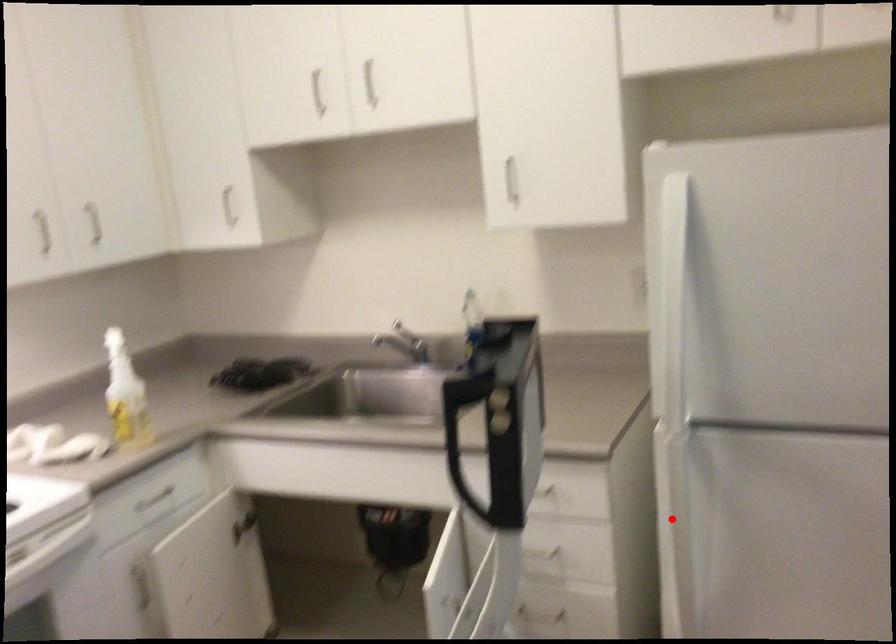
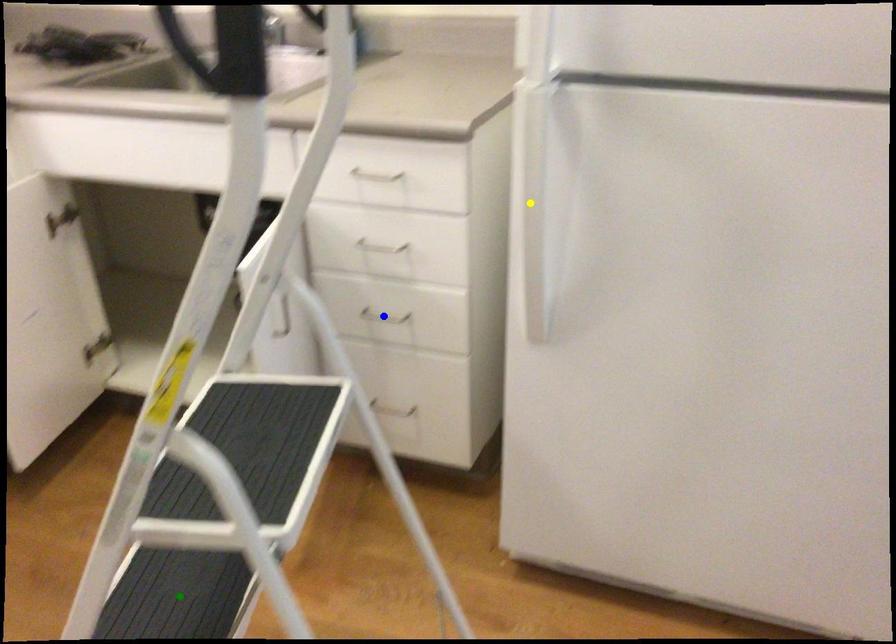
Question: I am providing you with two images of the same scene from different viewpoints. A red point is marked on the first image. You are given multiple points on the second image. In image 2, which mark is for the same physical point as the one in image 1?

Choices:
 (A) yellow point
 (B) green point
 (C) blue point

Answer: (A)